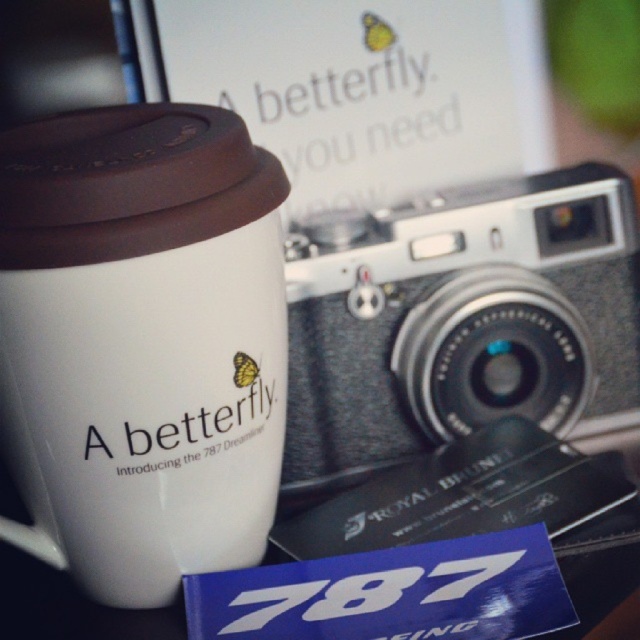
Question: Does white matte mug at left appear under silver textured film camera at center?

Choices:
 (A) no
 (B) yes

Answer: (B)

Question: Which of the following is the farthest from the observer?

Choices:
 (A) (442, 408)
 (B) (93, 195)

Answer: (A)

Question: From the image, what is the correct spatial relationship of white matte mug at left in relation to silver textured film camera at center?

Choices:
 (A) below
 (B) above

Answer: (A)

Question: Which point appears closest to the camera in this image?

Choices:
 (A) (352, 225)
 (B) (184, 461)

Answer: (B)

Question: Is white matte mug at left to the left of silver textured film camera at center from the viewer's perspective?

Choices:
 (A) yes
 (B) no

Answer: (A)